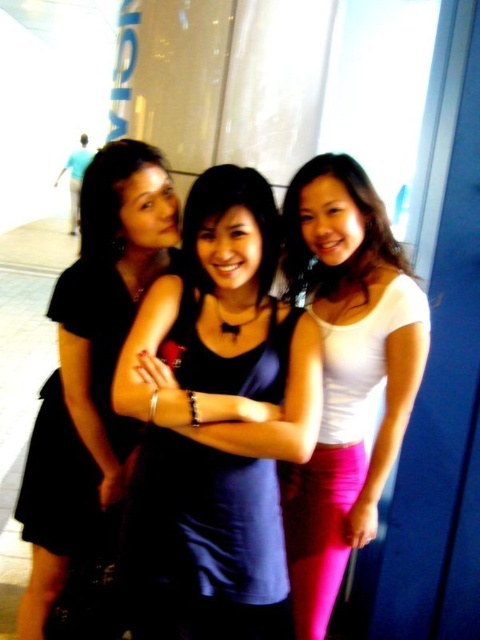
Question: Which point appears farthest from the camera in this image?

Choices:
 (A) (46, 540)
 (B) (253, 397)
 (C) (41, 628)

Answer: (C)

Question: Can you confirm if black matte dress at left is smaller than black matte dress at center?

Choices:
 (A) no
 (B) yes

Answer: (A)

Question: From the image, what is the correct spatial relationship of white matte shirt at center in relation to black matte dress at center?

Choices:
 (A) above
 (B) below

Answer: (A)

Question: Is white matte shirt at center thinner than black matte dress at left?

Choices:
 (A) yes
 (B) no

Answer: (A)

Question: Which point appears closest to the camera in this image?

Choices:
 (A) (169, 632)
 (B) (351, 282)
 (C) (152, 237)

Answer: (A)

Question: Estimate the real-world distances between objects in this image. Which object is closer to the white matte shirt at center?

Choices:
 (A) matte blue tank top at center
 (B) black matte dress at center
 (C) black matte dress at left

Answer: (A)